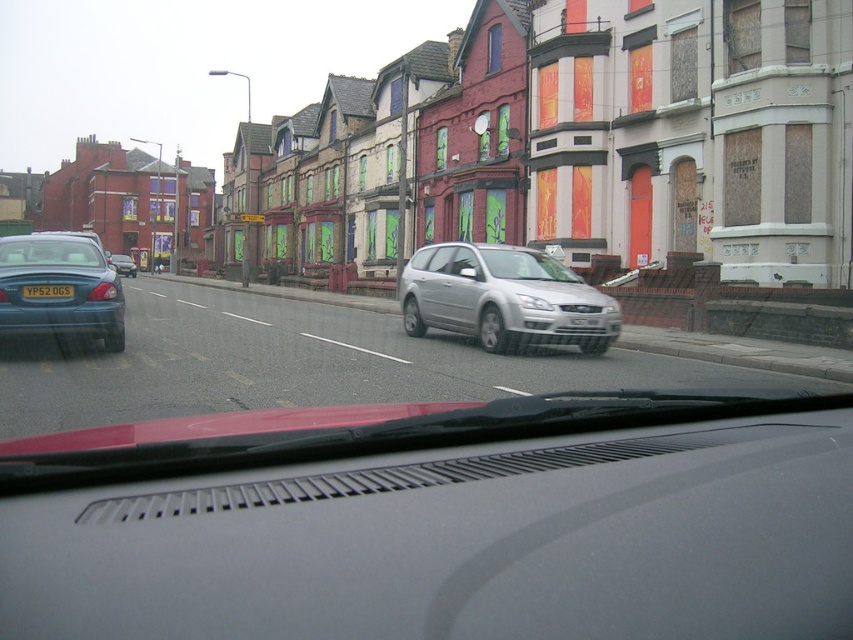
You are sitting in the driver seat of the vehicle and looking through the windshield. There are two points marked on the road ahead. The first point is at coordinates point (109, 314) and the second point is at coordinates point (45, 243). Which point is closer to you?

Point (109, 314) is closer to the camera than point (45, 243).